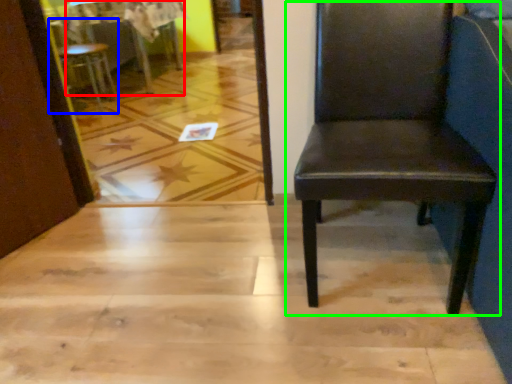
Question: Which is nearer to the table (highlighted by a red box)? chair (highlighted by a blue box) or chair (highlighted by a green box).

Choices:
 (A) chair
 (B) chair

Answer: (A)